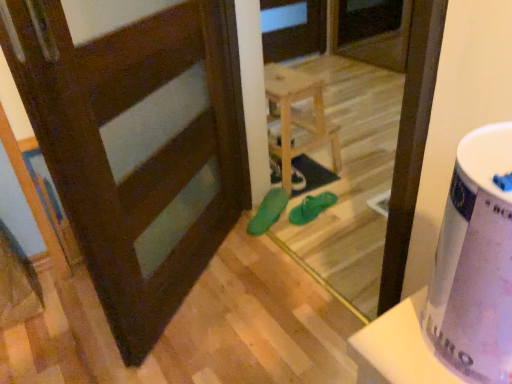
Find the location of a particular element. vacant space underneath dark brown wood door at center (from a real-world perspective) is located at coordinates (201, 279).